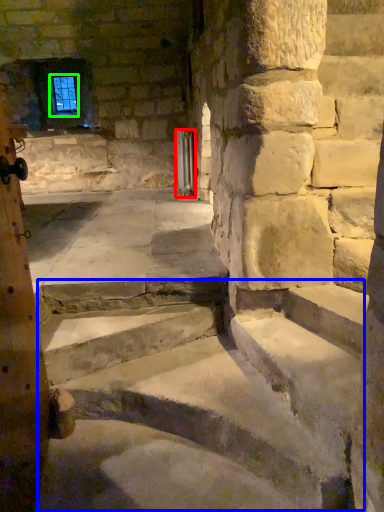
Question: Which object is positioned closest to door (highlighted by a red box)? Select from stairwell (highlighted by a blue box) and window screen (highlighted by a green box).

Choices:
 (A) stairwell
 (B) window screen

Answer: (B)